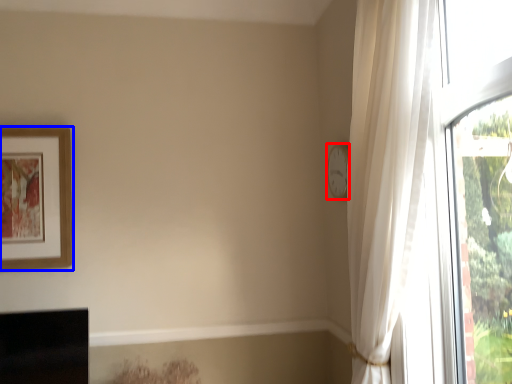
Question: Which of the following is the closest to the observer, clock (highlighted by a red box) or picture frame (highlighted by a blue box)?

Choices:
 (A) clock
 (B) picture frame

Answer: (A)